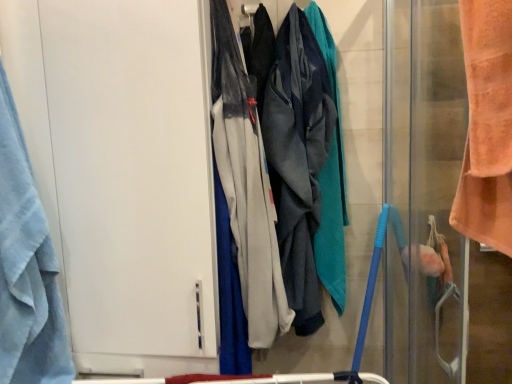
Question: From the image's perspective, is blue terry cloth towel at left over white matte door at left, positioned as the 1th screen door in left-to-right order?

Choices:
 (A) yes
 (B) no

Answer: (B)

Question: Is blue terry cloth towel at left at the left side of white matte door at left, the second screen door when ordered from right to left?

Choices:
 (A) no
 (B) yes

Answer: (B)

Question: From a real-world perspective, is blue terry cloth towel at left on top of white matte door at left, the second screen door when ordered from right to left?

Choices:
 (A) yes
 (B) no

Answer: (B)

Question: Does blue terry cloth towel at left come behind white matte door at left, the second screen door when ordered from right to left?

Choices:
 (A) yes
 (B) no

Answer: (B)

Question: Is blue terry cloth towel at left shorter than white matte door at left, positioned as the 1th screen door in left-to-right order?

Choices:
 (A) yes
 (B) no

Answer: (A)

Question: Considering the positions of gray fabric pants at center, the 1th wide when ordered from front to back, and orange towel at right, positioned as the second screen door in left-to-right order, in the image, is gray fabric pants at center, the 1th wide when ordered from front to back, wider or thinner than orange towel at right, positioned as the second screen door in left-to-right order,?

Choices:
 (A) thin
 (B) wide

Answer: (B)

Question: Is gray fabric pants at center, which is the second wide in back-to-front order, in front of or behind orange towel at right, positioned as the second screen door in left-to-right order, in the image?

Choices:
 (A) front
 (B) behind

Answer: (B)

Question: Choose the correct answer: Is gray fabric pants at center, which is the second wide in back-to-front order, inside orange towel at right, positioned as the second screen door in left-to-right order, or outside it?

Choices:
 (A) outside
 (B) inside

Answer: (A)

Question: Is gray fabric pants at center, the 1th wide when ordered from front to back, taller or shorter than orange towel at right, which appears as the first screen door when viewed from the right?

Choices:
 (A) tall
 (B) short

Answer: (B)

Question: Which is correct: gray fabric pants at center, which is the second wide in back-to-front order, is inside textured gray hoodie at center, which is the second wide from front to back, or outside of it?

Choices:
 (A) inside
 (B) outside

Answer: (B)

Question: From a real-world perspective, relative to textured gray hoodie at center, which is the second wide from front to back, is gray fabric pants at center, which is the second wide in back-to-front order, vertically above or below?

Choices:
 (A) below
 (B) above

Answer: (A)

Question: Is point (263, 244) closer or farther from the camera than point (283, 208)?

Choices:
 (A) closer
 (B) farther

Answer: (A)

Question: Relative to textured gray hoodie at center, which is the second wide from front to back, is gray fabric pants at center, which is the second wide in back-to-front order, in front or behind?

Choices:
 (A) front
 (B) behind

Answer: (A)

Question: From the image's perspective, is orange towel at right, which appears as the first screen door when viewed from the right, located above or below blue terry cloth towel at left?

Choices:
 (A) below
 (B) above

Answer: (A)

Question: Considering the relative positions of orange towel at right, which appears as the first screen door when viewed from the right, and blue terry cloth towel at left in the image provided, is orange towel at right, which appears as the first screen door when viewed from the right, to the left or to the right of blue terry cloth towel at left?

Choices:
 (A) left
 (B) right

Answer: (B)